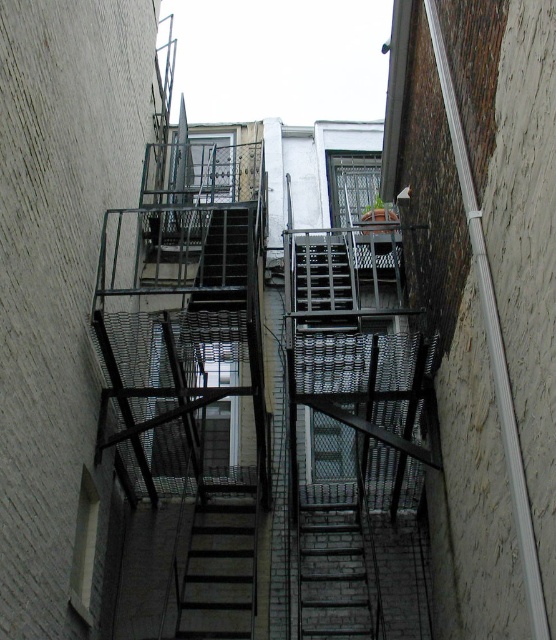
Question: Can you confirm if brick stairs at center is thinner than metallic gray stairs at center?

Choices:
 (A) no
 (B) yes

Answer: (A)

Question: Is brick stairs at center bigger than metallic gray stairs at center?

Choices:
 (A) no
 (B) yes

Answer: (B)

Question: From the image, what is the correct spatial relationship of brick stairs at center in relation to metallic gray stairs at center?

Choices:
 (A) left
 (B) right

Answer: (B)